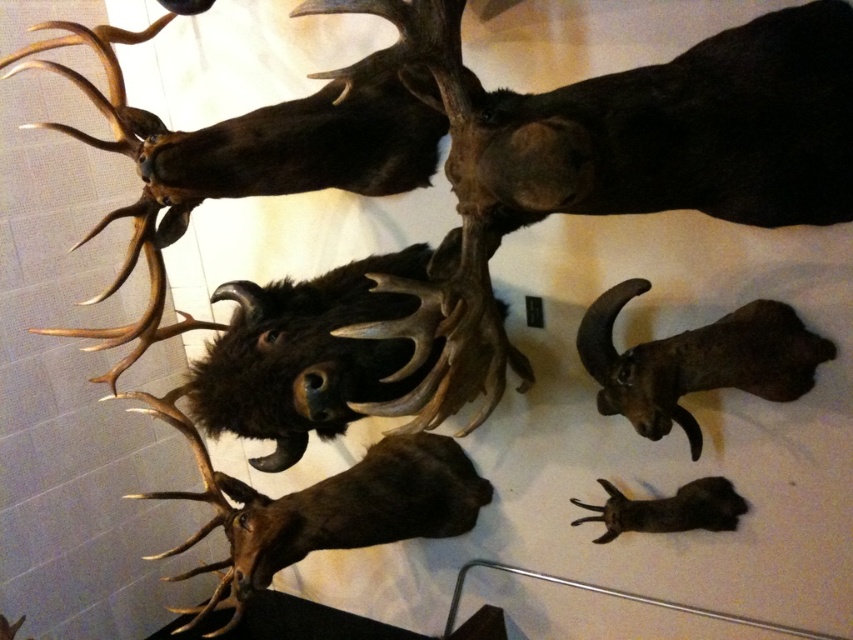
Question: Is brown matte skull at lower right to the left of brown furry rabbit at lower right from the viewer's perspective?

Choices:
 (A) no
 (B) yes

Answer: (A)

Question: Among these points, which one is farthest from the camera?

Choices:
 (A) (366, 266)
 (B) (817, 336)
 (C) (339, 493)
 (D) (616, 524)

Answer: (C)

Question: Is brown furry animal at center thinner than brown furry rabbit at lower right?

Choices:
 (A) yes
 (B) no

Answer: (B)

Question: Is brown furry animal at center to the left of brown furry rabbit at lower right from the viewer's perspective?

Choices:
 (A) yes
 (B) no

Answer: (A)

Question: Which point appears closest to the camera in this image?

Choices:
 (A) (712, 492)
 (B) (454, 516)
 (C) (767, 346)

Answer: (C)

Question: Which object is closer to the camera taking this photo?

Choices:
 (A) brown furry animal at center
 (B) brown furry rabbit at lower right

Answer: (A)